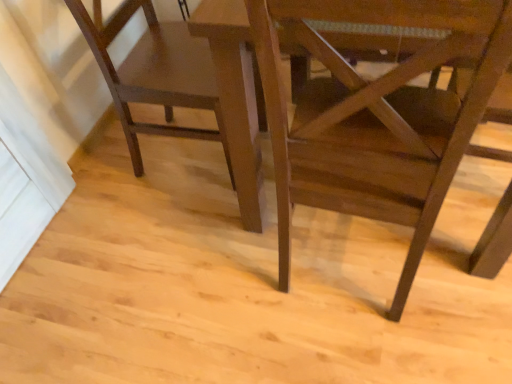
Question: Considering the relative positions of matte brown chair at left, arranged as the 2th chair when viewed from the right, and matte brown chair at lower right, the 1th chair from the right, in the image provided, is matte brown chair at left, arranged as the 2th chair when viewed from the right, in front of matte brown chair at lower right, the 1th chair from the right,?

Choices:
 (A) yes
 (B) no

Answer: (B)

Question: Is the surface of matte brown chair at left, arranged as the 2th chair when viewed from the right, in direct contact with matte brown chair at lower right, positioned as the 2th chair in left-to-right order?

Choices:
 (A) yes
 (B) no

Answer: (B)

Question: Does matte brown chair at left, arranged as the 2th chair when viewed from the right, have a greater width compared to matte brown chair at lower right, positioned as the 2th chair in left-to-right order?

Choices:
 (A) yes
 (B) no

Answer: (A)

Question: Does matte brown chair at left, the 1th chair viewed from the left, have a smaller size compared to matte brown chair at lower right, the 1th chair from the right?

Choices:
 (A) yes
 (B) no

Answer: (A)

Question: Is matte brown chair at lower right, the 1th chair from the right, completely or partially inside matte brown chair at left, arranged as the 2th chair when viewed from the right?

Choices:
 (A) yes
 (B) no

Answer: (B)

Question: Is matte brown chair at left, the 1th chair viewed from the left, at the left side of matte brown chair at lower right, the 1th chair from the right?

Choices:
 (A) yes
 (B) no

Answer: (A)

Question: Considering the relative sizes of matte brown chair at lower right, the 1th chair from the right, and matte brown chair at left, arranged as the 2th chair when viewed from the right, in the image provided, is matte brown chair at lower right, the 1th chair from the right, shorter than matte brown chair at left, arranged as the 2th chair when viewed from the right,?

Choices:
 (A) no
 (B) yes

Answer: (A)

Question: Considering the relative positions of matte brown chair at lower right, the 1th chair from the right, and matte brown chair at left, arranged as the 2th chair when viewed from the right, in the image provided, is matte brown chair at lower right, the 1th chair from the right, in front of matte brown chair at left, arranged as the 2th chair when viewed from the right,?

Choices:
 (A) no
 (B) yes

Answer: (B)

Question: Is matte brown chair at lower right, positioned as the 2th chair in left-to-right order, turned away from matte brown chair at left, arranged as the 2th chair when viewed from the right?

Choices:
 (A) yes
 (B) no

Answer: (B)

Question: Is matte brown chair at lower right, positioned as the 2th chair in left-to-right order, facing towards matte brown chair at left, arranged as the 2th chair when viewed from the right?

Choices:
 (A) no
 (B) yes

Answer: (A)

Question: From the image's perspective, is matte brown chair at lower right, positioned as the 2th chair in left-to-right order, on matte brown chair at left, the 1th chair viewed from the left?

Choices:
 (A) no
 (B) yes

Answer: (A)

Question: From a real-world perspective, is matte brown chair at lower right, the 1th chair from the right, under matte brown chair at left, the 1th chair viewed from the left?

Choices:
 (A) no
 (B) yes

Answer: (A)

Question: Based on their sizes in the image, would you say matte brown chair at left, arranged as the 2th chair when viewed from the right, is bigger or smaller than matte brown chair at lower right, the 1th chair from the right?

Choices:
 (A) big
 (B) small

Answer: (B)